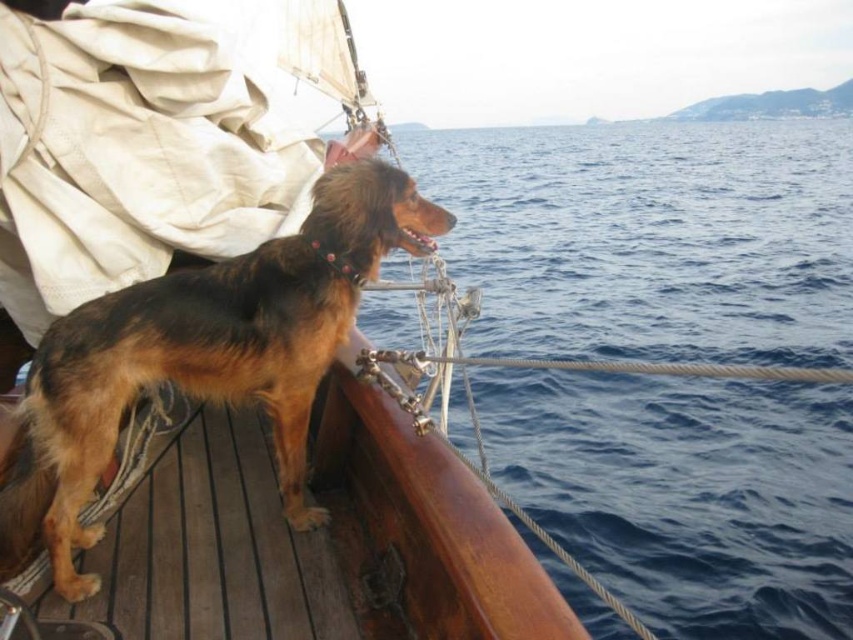
Question: Which point is closer to the camera taking this photo?

Choices:
 (A) (252, 316)
 (B) (772, 177)

Answer: (A)

Question: Is blue water at center below brown furry dog at left?

Choices:
 (A) no
 (B) yes

Answer: (A)

Question: Is blue water at center thinner than brown furry dog at left?

Choices:
 (A) no
 (B) yes

Answer: (A)

Question: Can you confirm if blue water at center is wider than brown furry dog at left?

Choices:
 (A) yes
 (B) no

Answer: (A)

Question: Which point is closer to the camera taking this photo?

Choices:
 (A) (16, 556)
 (B) (666, 356)

Answer: (A)